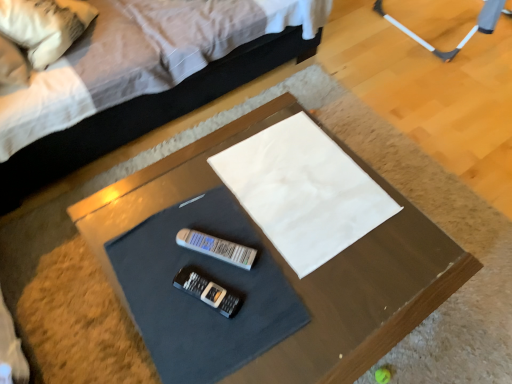
Question: Is white fabric pillow at upper left next to white fabric at center and touching it?

Choices:
 (A) yes
 (B) no

Answer: (B)

Question: Would you say white fabric pillow at upper left is outside white fabric at center?

Choices:
 (A) no
 (B) yes

Answer: (B)

Question: Is white fabric pillow at upper left to the right of white fabric at center from the viewer's perspective?

Choices:
 (A) no
 (B) yes

Answer: (A)

Question: Does white fabric pillow at upper left turn towards white fabric at center?

Choices:
 (A) no
 (B) yes

Answer: (B)

Question: Is white fabric pillow at upper left bigger than white fabric at center?

Choices:
 (A) yes
 (B) no

Answer: (A)

Question: Does white fabric pillow at upper left have a lesser width compared to white fabric at center?

Choices:
 (A) no
 (B) yes

Answer: (B)

Question: Is white fabric bed at upper center positioned beyond the bounds of smooth brown table at center?

Choices:
 (A) yes
 (B) no

Answer: (A)

Question: Considering the relative sizes of white fabric bed at upper center and smooth brown table at center in the image provided, is white fabric bed at upper center smaller than smooth brown table at center?

Choices:
 (A) yes
 (B) no

Answer: (B)

Question: Does white fabric bed at upper center contain smooth brown table at center?

Choices:
 (A) yes
 (B) no

Answer: (B)

Question: Is white fabric bed at upper center in front of smooth brown table at center?

Choices:
 (A) yes
 (B) no

Answer: (B)

Question: Is white fabric bed at upper center positioned far away from smooth brown table at center?

Choices:
 (A) no
 (B) yes

Answer: (A)

Question: Does white fabric bed at upper center have a lesser height compared to smooth brown table at center?

Choices:
 (A) no
 (B) yes

Answer: (A)

Question: From the image's perspective, would you say white fabric pillow at upper left is positioned over smooth brown table at center?

Choices:
 (A) yes
 (B) no

Answer: (A)